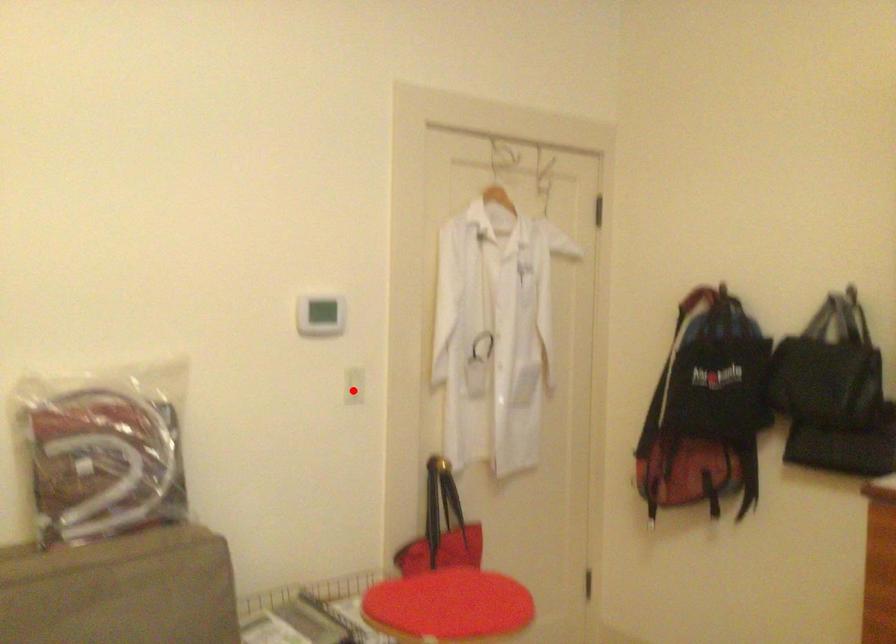
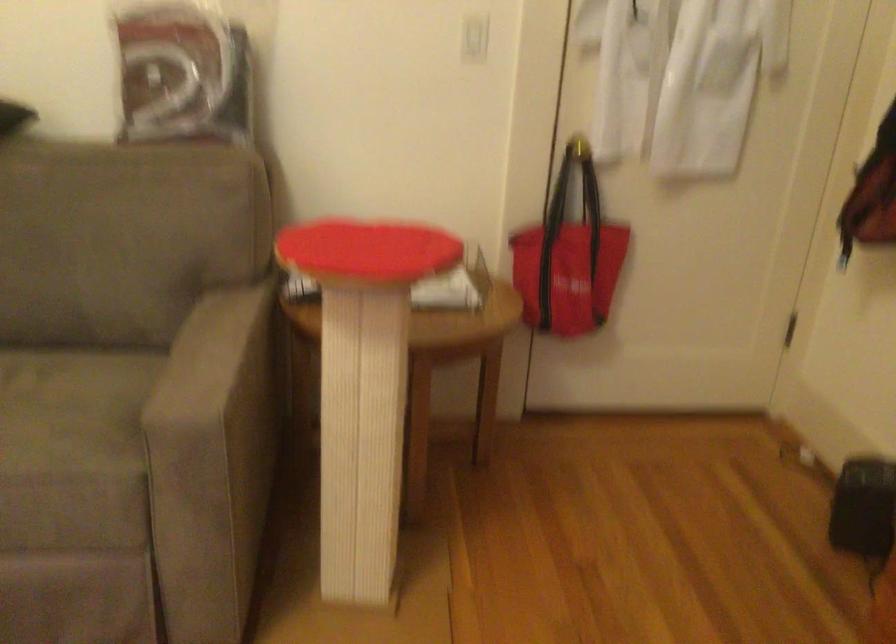
Question: I am providing you with two images of the same scene from different viewpoints. Given a red point in image1, look at the same physical point in image2. Is it:

Choices:
 (A) Closer to the viewpoint
 (B) Farther from the viewpoint

Answer: (A)